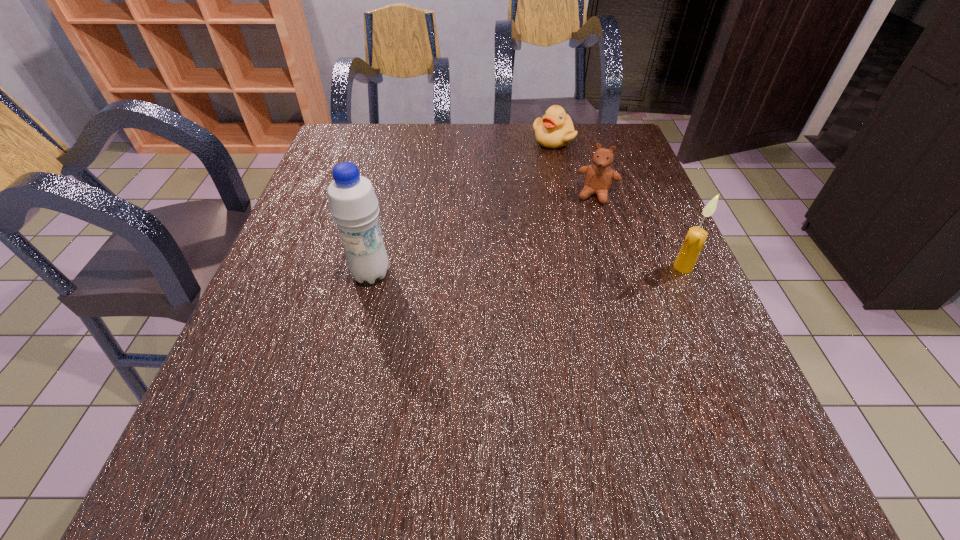
Find the location of `vacant region between the water bottle and the shortest object`. vacant region between the water bottle and the shortest object is located at coordinates (462, 207).

At what (x,y) coordinates should I click in order to perform the action: click on vacant area between the farthest object and the rightmost object. Please return your answer as a coordinate pair (x, y). Looking at the image, I should click on (618, 204).

Find the location of a particular element. This screenshot has width=960, height=540. free space between the farthest object and the second farthest object is located at coordinates (x=575, y=167).

Where is `vacant space in between the duckling and the third nearest object`? This screenshot has height=540, width=960. vacant space in between the duckling and the third nearest object is located at coordinates (575, 167).

At what (x,y) coordinates should I click in order to perform the action: click on free space between the candle and the water bottle. Please return your answer as a coordinate pair (x, y). This screenshot has width=960, height=540. Looking at the image, I should click on (527, 271).

Where is `vacant space that's between the second tallest object and the teddy bear`? vacant space that's between the second tallest object and the teddy bear is located at coordinates (640, 231).

Identify the location of the second closest object to the second farthest object. This screenshot has width=960, height=540. (695, 239).

Find the location of a particular element. the closest object to the tallest object is located at coordinates (598, 177).

The image size is (960, 540). Find the location of `free spot that satisfies the following two spatial constraints: 1. on the front side of the candle; 2. on the right side of the shortest object`. free spot that satisfies the following two spatial constraints: 1. on the front side of the candle; 2. on the right side of the shortest object is located at coordinates (582, 267).

The height and width of the screenshot is (540, 960). I want to click on vacant position in the image that satisfies the following two spatial constraints: 1. on the front side of the rightmost object; 2. on the left side of the farthest object, so click(x=582, y=267).